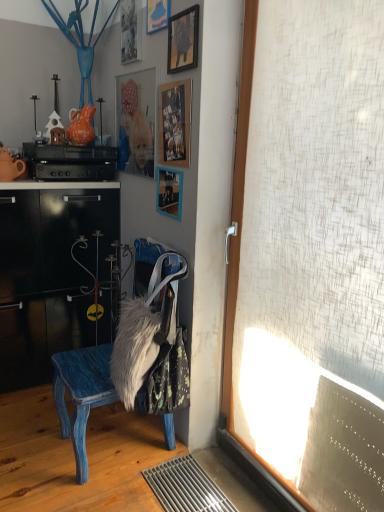
Question: Is wooden picture frame at upper center, placed as the 1th picture frame when sorted from bottom to top, closer to the viewer compared to wooden picture frame at upper center, arranged as the 3th picture frame when viewed from the top?

Choices:
 (A) no
 (B) yes

Answer: (A)

Question: Can you confirm if wooden picture frame at upper center, placed as the 1th picture frame when sorted from bottom to top, is thinner than wooden picture frame at upper center, arranged as the 3th picture frame when viewed from the top?

Choices:
 (A) no
 (B) yes

Answer: (A)

Question: From the image's perspective, does wooden picture frame at upper center, placed as the 1th picture frame when sorted from bottom to top, appear lower than wooden picture frame at upper center, positioned as the third picture frame in bottom-to-top order?

Choices:
 (A) yes
 (B) no

Answer: (A)

Question: Does wooden picture frame at upper center, arranged as the fifth picture frame when viewed from the top, have a lesser height compared to wooden picture frame at upper center, arranged as the 3th picture frame when viewed from the top?

Choices:
 (A) yes
 (B) no

Answer: (A)

Question: Is wooden picture frame at upper center, arranged as the fifth picture frame when viewed from the top, surrounding wooden picture frame at upper center, arranged as the 3th picture frame when viewed from the top?

Choices:
 (A) yes
 (B) no

Answer: (B)

Question: Does wooden picture frame at upper center, placed as the 1th picture frame when sorted from bottom to top, have a greater height compared to wooden picture frame at upper center, arranged as the 3th picture frame when viewed from the top?

Choices:
 (A) no
 (B) yes

Answer: (A)

Question: Does wooden picture frame at upper center, arranged as the 3th picture frame when viewed from the top, have a greater width compared to matte blue picture frame at upper center, the 1th picture frame from the top?

Choices:
 (A) yes
 (B) no

Answer: (A)

Question: From a real-world perspective, is wooden picture frame at upper center, positioned as the third picture frame in bottom-to-top order, physically above matte blue picture frame at upper center, placed as the 5th picture frame when sorted from bottom to top?

Choices:
 (A) yes
 (B) no

Answer: (B)

Question: Can you see wooden picture frame at upper center, arranged as the 3th picture frame when viewed from the top, touching matte blue picture frame at upper center, the 1th picture frame from the top?

Choices:
 (A) yes
 (B) no

Answer: (B)

Question: From the image's perspective, is wooden picture frame at upper center, arranged as the 3th picture frame when viewed from the top, located beneath matte blue picture frame at upper center, placed as the 5th picture frame when sorted from bottom to top?

Choices:
 (A) no
 (B) yes

Answer: (B)

Question: Is the depth of wooden picture frame at upper center, arranged as the 3th picture frame when viewed from the top, less than that of matte blue picture frame at upper center, the 1th picture frame from the top?

Choices:
 (A) yes
 (B) no

Answer: (A)

Question: Does wooden picture frame at upper center, positioned as the third picture frame in bottom-to-top order, have a smaller size compared to matte blue picture frame at upper center, the 1th picture frame from the top?

Choices:
 (A) yes
 (B) no

Answer: (B)

Question: Is blonde hair doll at upper center taller than blue painted wood chair at center?

Choices:
 (A) no
 (B) yes

Answer: (A)